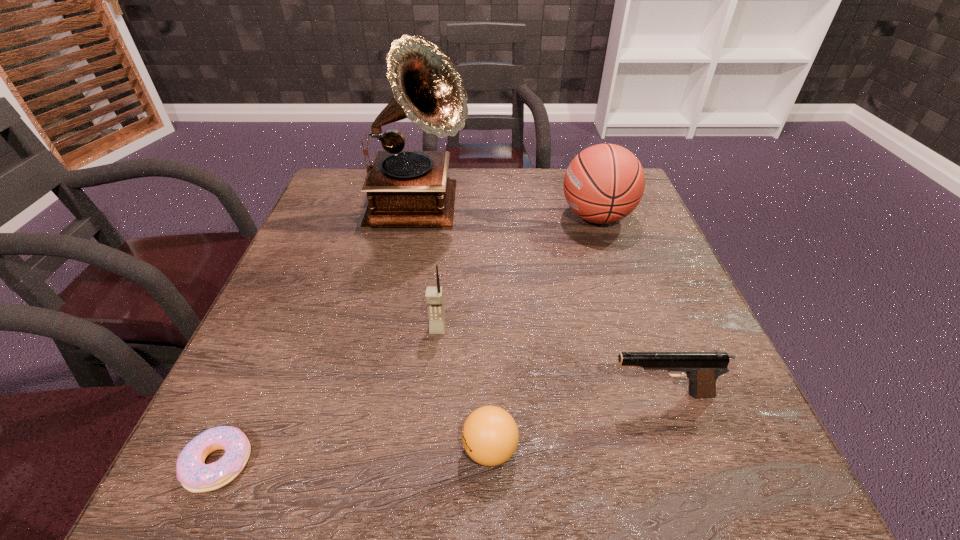
The height and width of the screenshot is (540, 960). I want to click on the tallest object, so click(x=404, y=188).

Identify the location of basketball. Image resolution: width=960 pixels, height=540 pixels. (604, 183).

Locate an element on the screen. The height and width of the screenshot is (540, 960). the fourth shortest object is located at coordinates (434, 294).

Where is `the third farthest object`? the third farthest object is located at coordinates (434, 294).

Where is `the third nearest object`? the third nearest object is located at coordinates (702, 368).

The width and height of the screenshot is (960, 540). I want to click on pistol, so click(702, 368).

At what (x,y) coordinates should I click in order to perform the action: click on ping-pong ball. Please return your answer as a coordinate pair (x, y). The width and height of the screenshot is (960, 540). Looking at the image, I should click on pos(490,435).

The height and width of the screenshot is (540, 960). I want to click on the leftmost object, so click(195, 476).

Where is `the shortest object`? the shortest object is located at coordinates (195, 476).

Where is `free space located on the horn of the tallest object`? This screenshot has width=960, height=540. free space located on the horn of the tallest object is located at coordinates (615, 210).